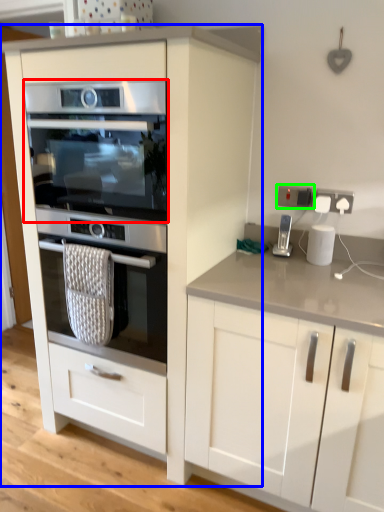
Question: Based on their relative distances, which object is farther from oven (highlighted by a red box)? Choose from cabinetry (highlighted by a blue box) and electric outlet (highlighted by a green box).

Choices:
 (A) cabinetry
 (B) electric outlet

Answer: (B)